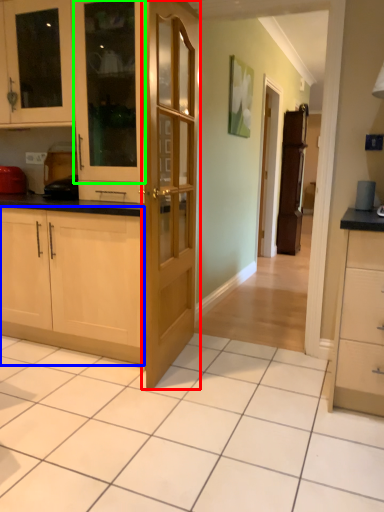
Question: Estimate the real-world distances between objects in this image. Which object is closer to door (highlighted by a red box), cabinetry (highlighted by a blue box) or cabinetry (highlighted by a green box)?

Choices:
 (A) cabinetry
 (B) cabinetry

Answer: (B)